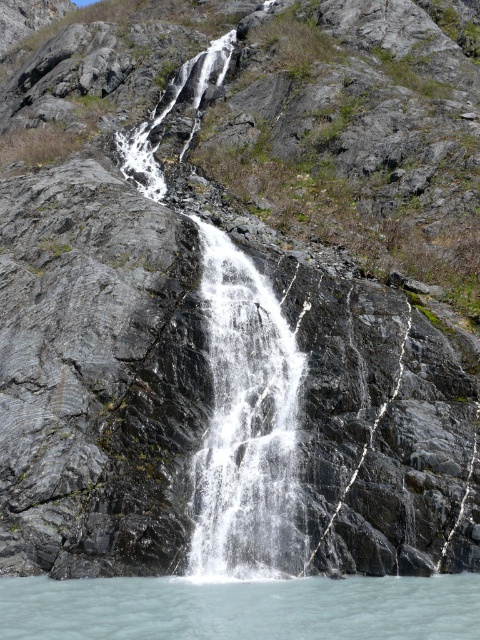
Question: Among these points, which one is farthest from the camera?

Choices:
 (A) (202, 296)
 (B) (394, 600)

Answer: (A)

Question: Which object appears closest to the camera in this image?

Choices:
 (A) clear water at lower center
 (B) white frothy water at center

Answer: (A)

Question: Can you confirm if white frothy water at center is wider than clear water at lower center?

Choices:
 (A) yes
 (B) no

Answer: (B)

Question: Is white frothy water at center closer to camera compared to clear water at lower center?

Choices:
 (A) no
 (B) yes

Answer: (A)

Question: Does white frothy water at center have a larger size compared to clear water at lower center?

Choices:
 (A) no
 (B) yes

Answer: (B)